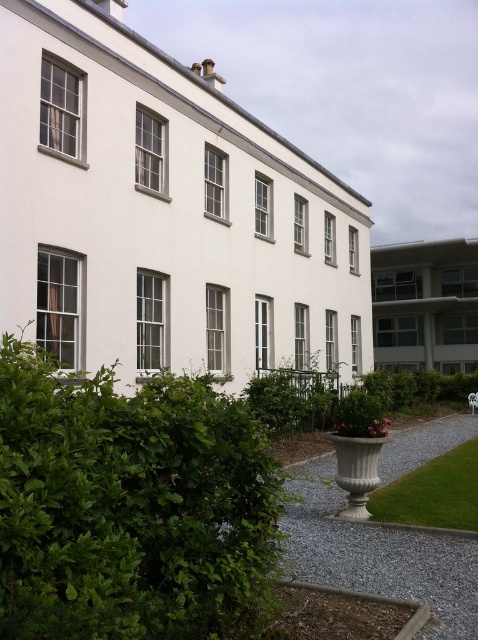
Question: Which point is farther to the camera?

Choices:
 (A) green grass at lower right
 (B) green leafy hedge at lower left

Answer: (A)

Question: Is green leafy hedge at lower left thinner than green grass at lower right?

Choices:
 (A) yes
 (B) no

Answer: (B)

Question: Which of the following is the closest to the observer?

Choices:
 (A) (29, 580)
 (B) (476, 454)

Answer: (A)

Question: From the image, what is the correct spatial relationship of green leafy hedge at lower left in relation to green grass at lower right?

Choices:
 (A) left
 (B) right

Answer: (A)

Question: Is green leafy hedge at lower left to the left of green grass at lower right from the viewer's perspective?

Choices:
 (A) no
 (B) yes

Answer: (B)